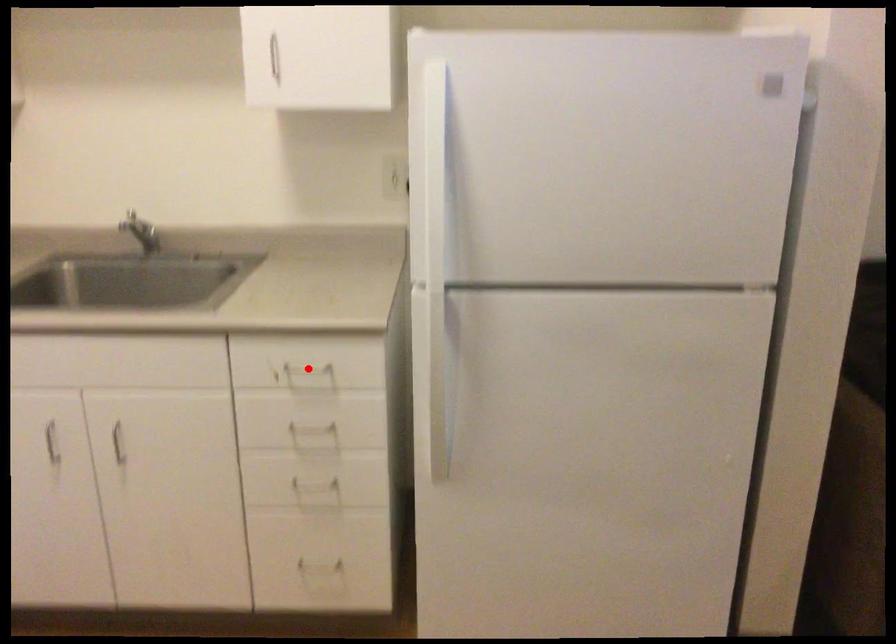
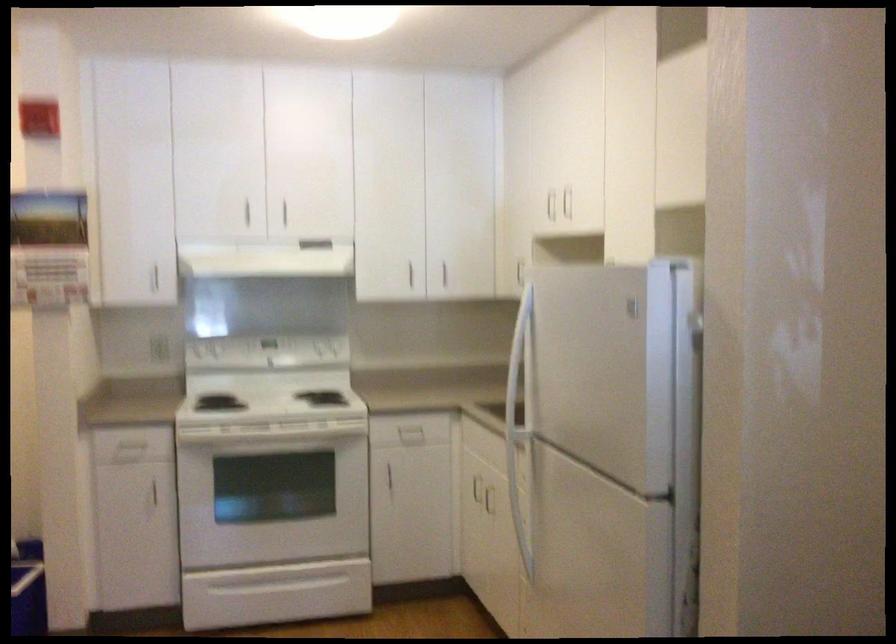
Question: I am providing you with two images of the same scene from different viewpoints. A red point is marked on the first image. Is the red point's position out of view in image 2?

Choices:
 (A) Yes
 (B) No

Answer: (A)